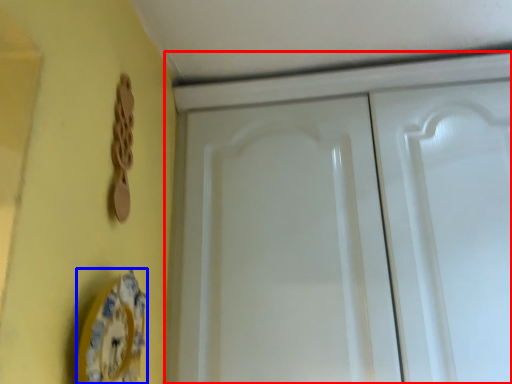
Question: Which object is further to the camera taking this photo, cabinetry (highlighted by a red box) or plate (highlighted by a blue box)?

Choices:
 (A) cabinetry
 (B) plate

Answer: (A)